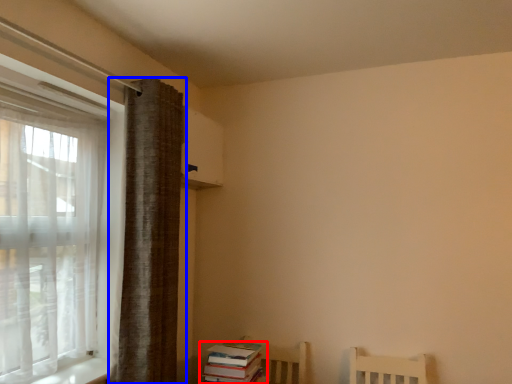
Question: Which point is further to the camera, book (highlighted by a red box) or curtain (highlighted by a blue box)?

Choices:
 (A) book
 (B) curtain

Answer: (A)